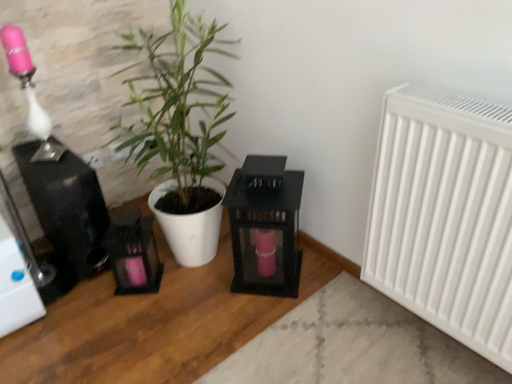
The image size is (512, 384). I want to click on free space between black glass lantern at center and white matte plant pot at center, so click(x=213, y=287).